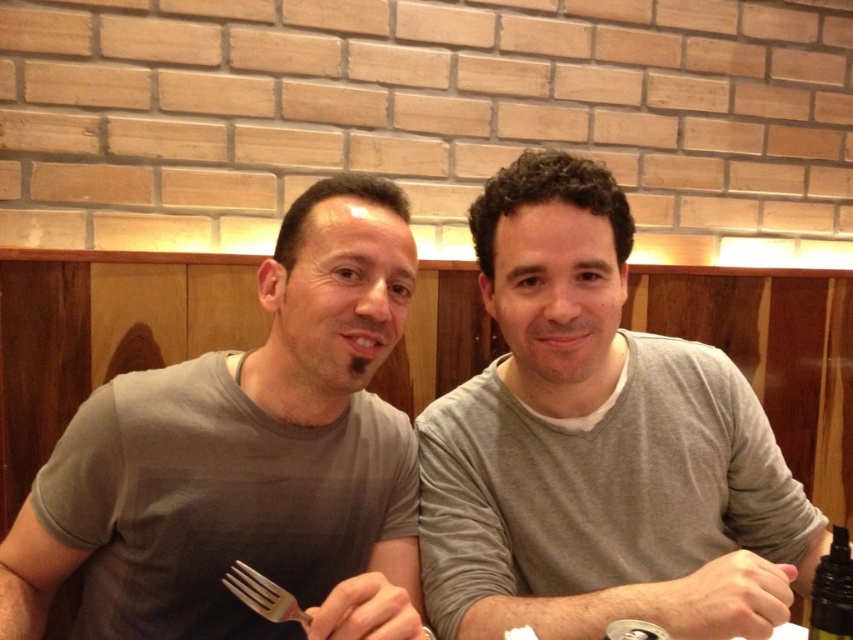
Question: Can you confirm if gray cotton shirt at center is positioned below silver metallic fork at lower center?

Choices:
 (A) no
 (B) yes

Answer: (A)

Question: Does gray cotton shirt at center have a smaller size compared to gray matte t-shirt at center?

Choices:
 (A) yes
 (B) no

Answer: (B)

Question: Estimate the real-world distances between objects in this image. Which object is farther from the gray cotton shirt at center?

Choices:
 (A) gray matte t-shirt at center
 (B) silver metallic fork at lower center

Answer: (B)

Question: In this image, where is gray cotton shirt at center located relative to silver metallic fork at lower center?

Choices:
 (A) below
 (B) above

Answer: (B)

Question: Which point is closer to the camera?

Choices:
 (A) silver metallic fork at lower center
 (B) gray cotton shirt at center
 (C) gray matte t-shirt at center

Answer: (C)

Question: Which of the following is the farthest from the observer?

Choices:
 (A) gray matte t-shirt at center
 (B) silver metallic fork at lower center

Answer: (B)